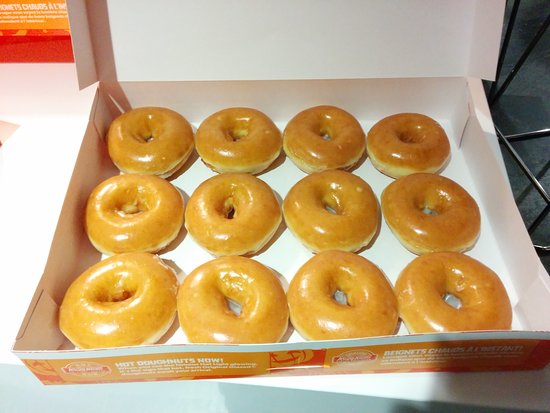
Image resolution: width=550 pixels, height=413 pixels. I want to click on box, so click(287, 258).